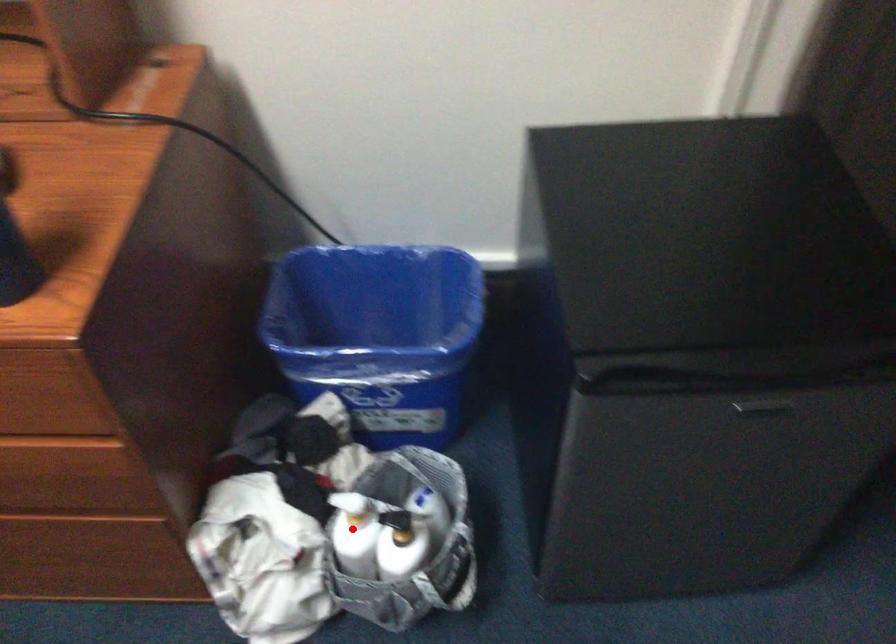
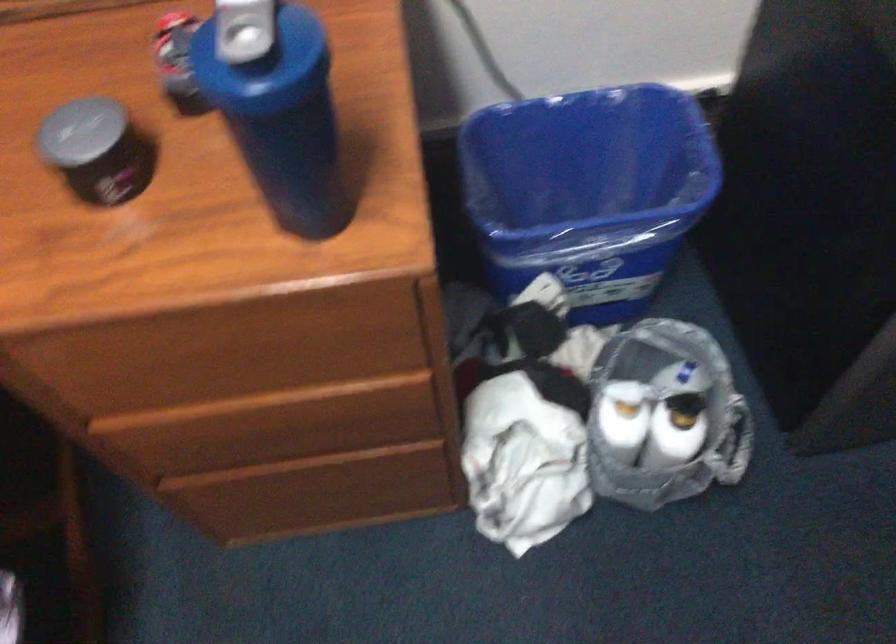
Where in the second image is the point corresponding to the highlighted location from the first image?

(624, 418)